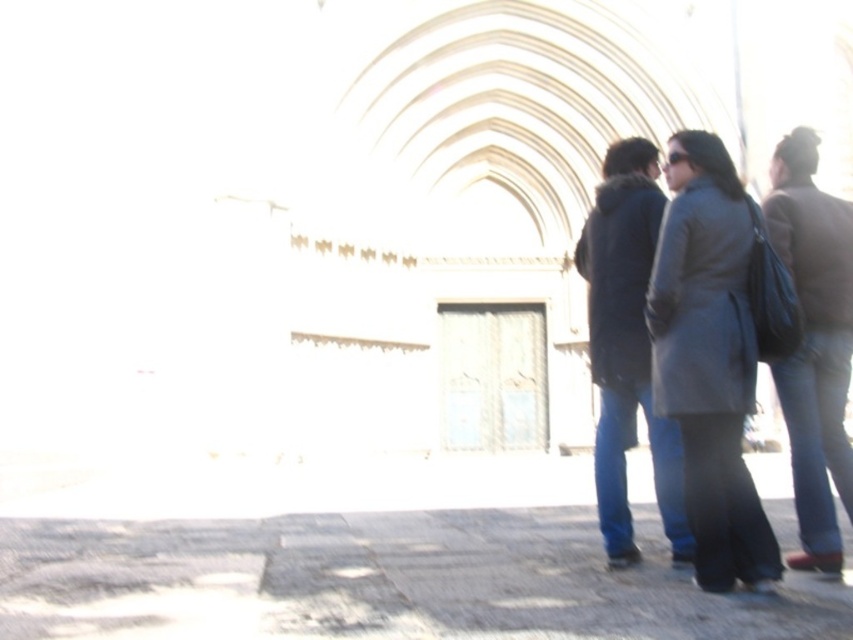
You are standing on the gray stone pavement at lower center and want to reach the dark gray coat at right. Which direction should you move to get closer to the coat?

The gray stone pavement at lower center is positioned under the dark gray coat at right, so you should move upward to reach the coat.